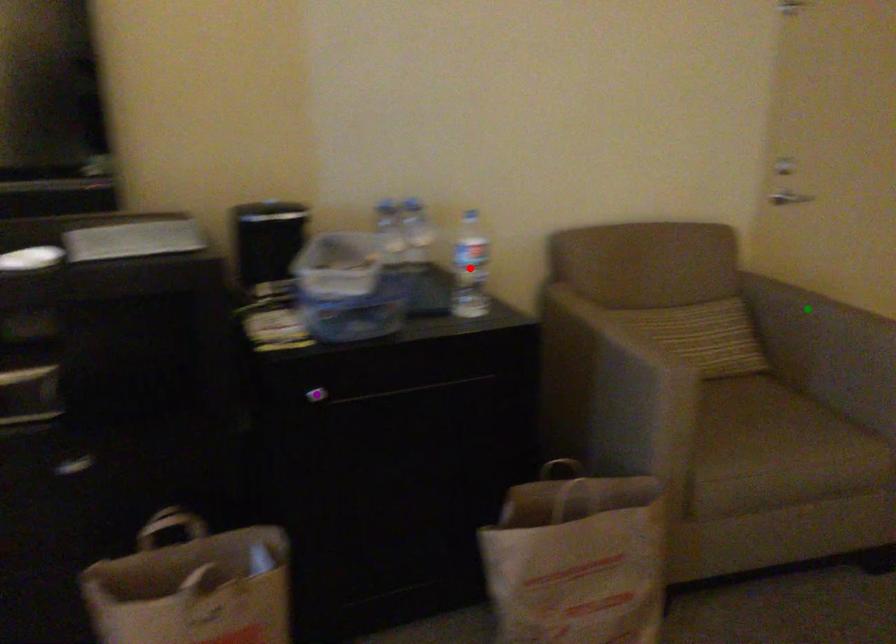
Order these from farthest to nearest:
1. purple point
2. red point
3. green point

1. green point
2. red point
3. purple point